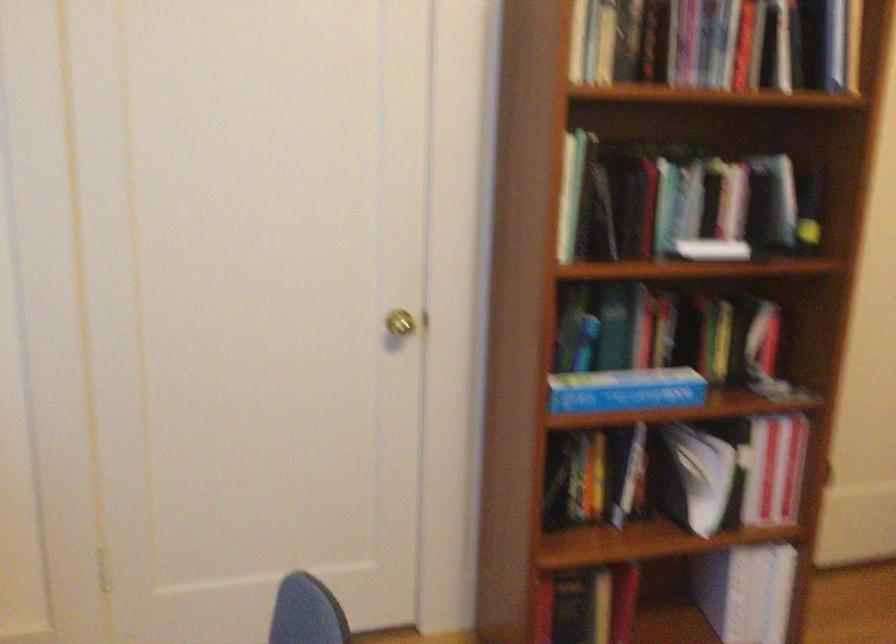
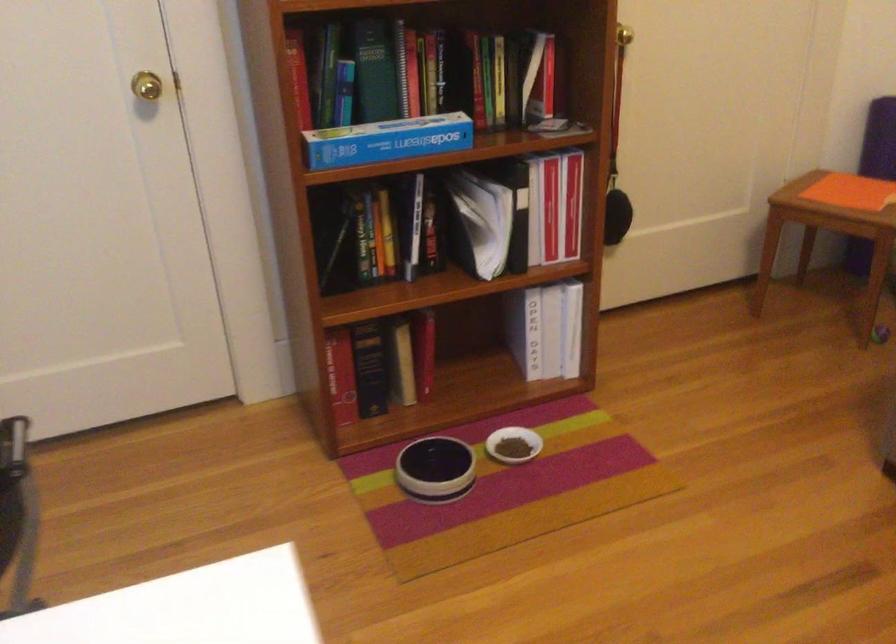
Question: Based on the continuous images, in which direction is the camera rotating? Reply with the corresponding letter.

Choices:
 (A) Left
 (B) Right
 (C) Up
 (D) Down

Answer: (D)